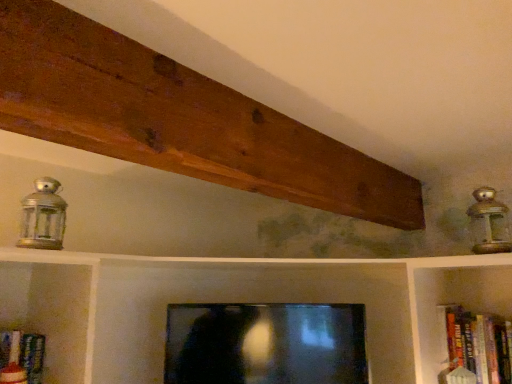
Question: Considering their positions, is brown wood plank at upper center located in front of or behind silver metallic lantern at left, the 2th lamp positioned from the right?

Choices:
 (A) behind
 (B) front

Answer: (B)

Question: Is brown wood plank at upper center spatially inside silver metallic lantern at left, the 2th lamp positioned from the right, or outside of it?

Choices:
 (A) outside
 (B) inside

Answer: (A)

Question: Which is farther from the hardcover book at right?

Choices:
 (A) metallic lantern at upper right, which is the 2th lamp in left-to-right order
 (B) brown wood plank at upper center
 (C) silver metallic lantern at left, the 2th lamp positioned from the right
 (D) matte black tv at center

Answer: (C)

Question: Which object is positioned closest to the silver metallic lantern at left, which is counted as the first lamp, starting from the left?

Choices:
 (A) brown wood plank at upper center
 (B) hardcover book at right
 (C) metallic lantern at upper right, which ranks as the first lamp in right-to-left order
 (D) matte black tv at center

Answer: (A)